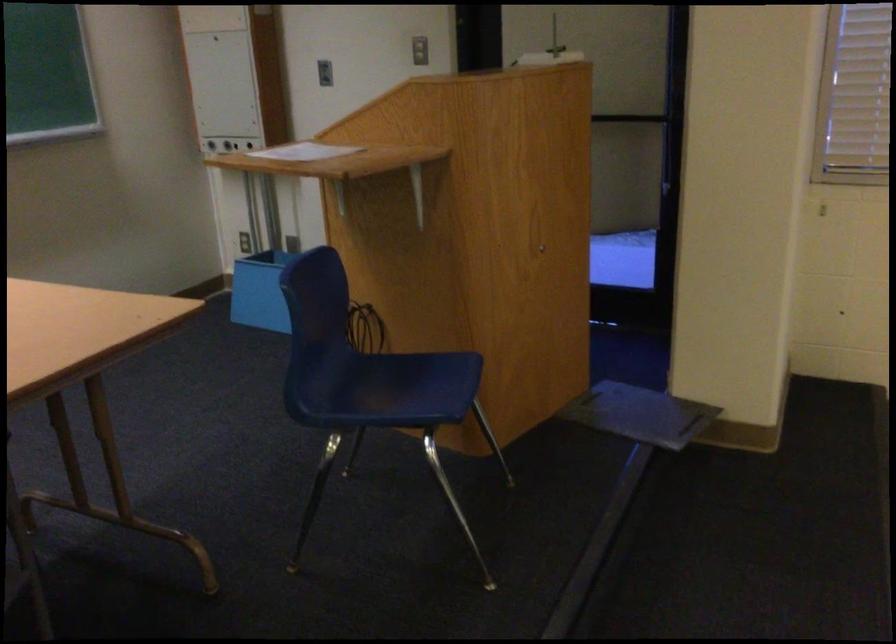
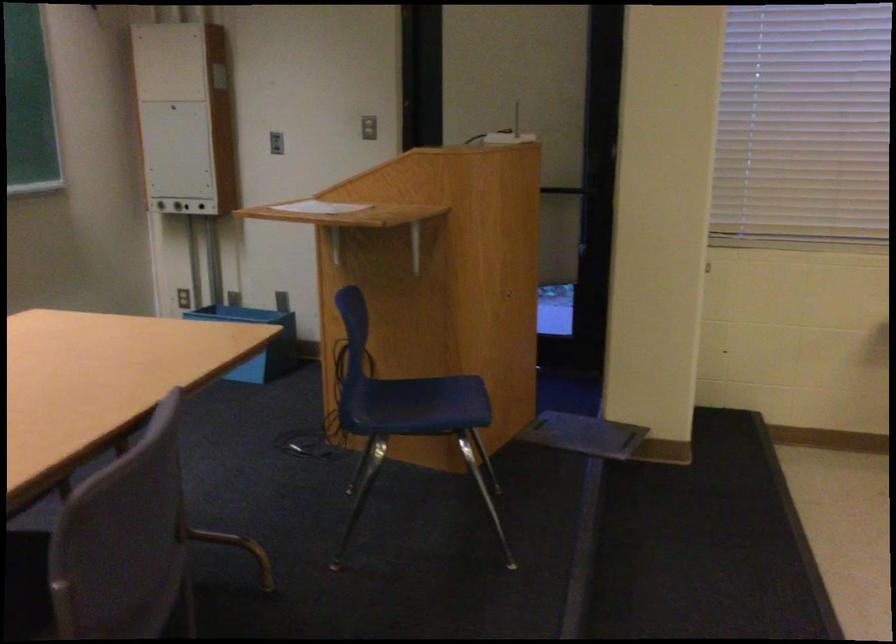
Question: The camera is either moving clockwise (left) or counter-clockwise (right) around the object. The first image is from the beginning of the video and the second image is from the end. Is the camera moving left or right when shooting the video?

Choices:
 (A) Left
 (B) Right

Answer: (A)